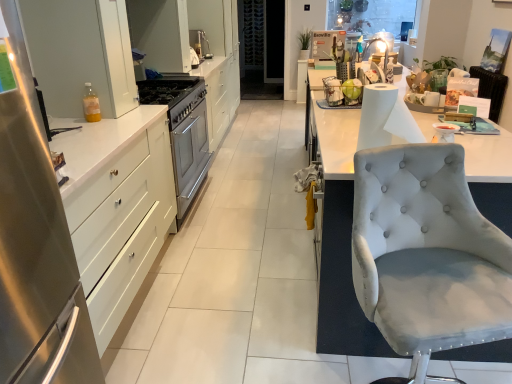
The height and width of the screenshot is (384, 512). I want to click on free space between white glossy cabinet at upper left, the second cabinetry in the bottom-to-top sequence, and translucent plastic bottle at left, so click(86, 115).